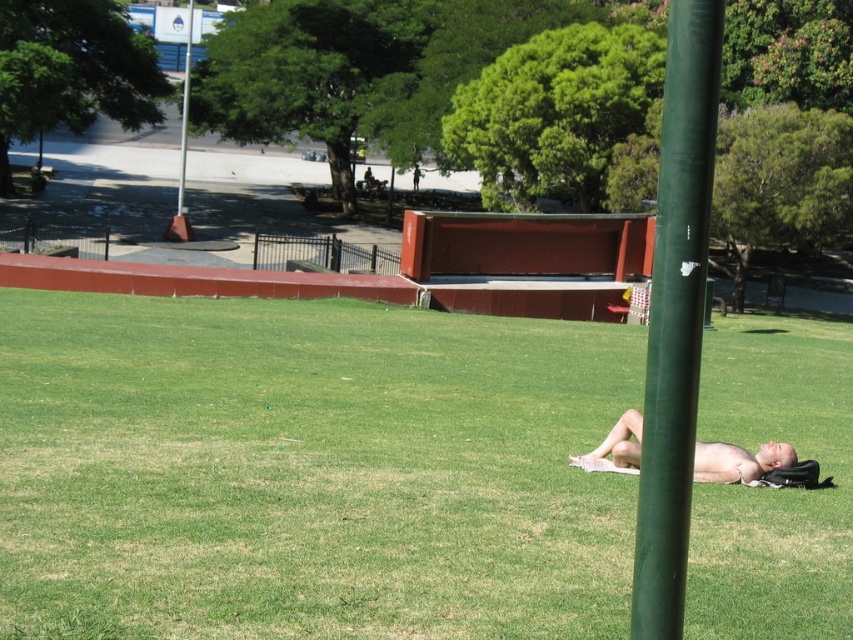
Based on the photo, you are a photographer trying to capture a clear shot of the nude skin at lower right without any obstructions. Given the presence of the green matte pole at center, can you adjust your position to avoid the pole blocking the view?

The green matte pole at center is positioned on the right side of the nude skin at lower right. To avoid the pole blocking the view, move to the left side of the scene so that the pole is no longer between you and the nude skin at lower right.

You are a photographer trying to capture the entire scene without any obstructions. Considering the nude skin at lower right and the green matte pole at upper center, which object would you need to adjust your camera angle to avoid blocking the other?

The green matte pole at upper center is taller than the nude skin at lower right, so adjusting the camera angle to lower the view might help avoid blocking the nude skin at lower right by the green matte pole at upper center.